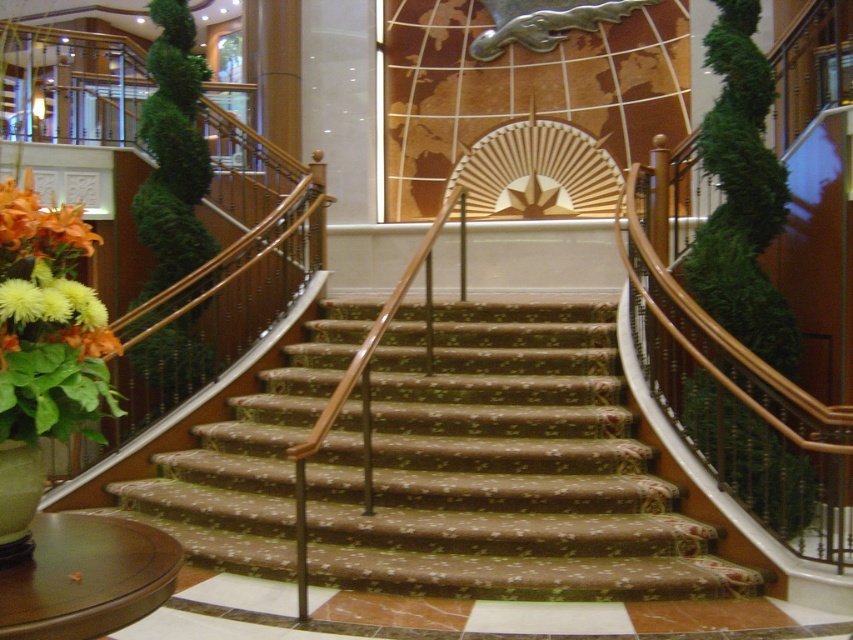
Does brown textured carpet at center lie in front of yellow matte flower at lower left?

No, brown textured carpet at center is behind yellow matte flower at lower left.

Locate an element on the screen. This screenshot has height=640, width=853. brown textured carpet at center is located at coordinates (505, 470).

Does yellow matte flower at lower left have a larger size compared to orange matte flower at lower left?

Indeed, yellow matte flower at lower left has a larger size compared to orange matte flower at lower left.

Which is more to the right, yellow matte flower at lower left or orange matte flower at lower left?

yellow matte flower at lower left is more to the right.

What do you see at coordinates (45, 275) in the screenshot? This screenshot has width=853, height=640. I see `yellow matte flower at lower left` at bounding box center [45, 275].

You are a GUI agent. You are given a task and a screenshot of the screen. Output one action in this format:
    pyautogui.click(x=<x>, y=<y>)
    Task: Click on the yellow matte flower at lower left
    The height and width of the screenshot is (640, 853).
    Given the screenshot: What is the action you would take?
    coord(45,275)

Locate an element on the screen. This screenshot has width=853, height=640. brown textured carpet at center is located at coordinates (505, 470).

Can you confirm if brown textured carpet at center is positioned above orange matte flower at lower left?

Actually, brown textured carpet at center is below orange matte flower at lower left.

You are a GUI agent. You are given a task and a screenshot of the screen. Output one action in this format:
    pyautogui.click(x=<x>, y=<y>)
    Task: Click on the brown textured carpet at center
    The height and width of the screenshot is (640, 853).
    Given the screenshot: What is the action you would take?
    pyautogui.click(x=505, y=470)

The height and width of the screenshot is (640, 853). Find the location of `brown textured carpet at center`. brown textured carpet at center is located at coordinates tap(505, 470).